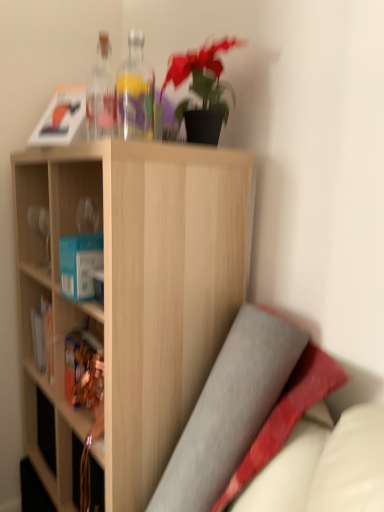
Question: From a real-world perspective, is transparent glass bottle at upper center, placed as the first bottle when sorted from right to left, located beneath matte brown book at left?

Choices:
 (A) no
 (B) yes

Answer: (A)

Question: Is transparent glass bottle at upper center, placed as the first bottle when sorted from right to left, taller than matte brown book at left?

Choices:
 (A) yes
 (B) no

Answer: (A)

Question: From the image's perspective, would you say transparent glass bottle at upper center, positioned as the second bottle in left-to-right order, is shown under matte brown book at left?

Choices:
 (A) yes
 (B) no

Answer: (B)

Question: Is transparent glass bottle at upper center, positioned as the second bottle in left-to-right order, located outside matte brown book at left?

Choices:
 (A) no
 (B) yes

Answer: (B)

Question: Is transparent glass bottle at upper center, positioned as the second bottle in left-to-right order, oriented towards matte brown book at left?

Choices:
 (A) no
 (B) yes

Answer: (A)

Question: Do you think transparent glass bottle at upper center, positioned as the second bottle in left-to-right order, is within matte brown book at left, or outside of it?

Choices:
 (A) outside
 (B) inside

Answer: (A)

Question: Is point click(127, 124) positioned closer to the camera than point click(76, 370)?

Choices:
 (A) closer
 (B) farther

Answer: (A)

Question: Is transparent glass bottle at upper center, placed as the first bottle when sorted from right to left, to the left or to the right of matte brown book at left in the image?

Choices:
 (A) left
 (B) right

Answer: (B)

Question: From the image's perspective, is transparent glass bottle at upper center, placed as the first bottle when sorted from right to left, positioned above or below matte brown book at left?

Choices:
 (A) above
 (B) below

Answer: (A)

Question: From the image's perspective, relative to transparent glass bottle at upper center, placed as the first bottle when sorted from right to left, is transparent glass bottles at upper center, which is counted as the first bottle, starting from the left, above or below?

Choices:
 (A) below
 (B) above

Answer: (B)

Question: Relative to transparent glass bottle at upper center, placed as the first bottle when sorted from right to left, is transparent glass bottles at upper center, the 2th bottle from the right, in front or behind?

Choices:
 (A) front
 (B) behind

Answer: (B)

Question: Based on their sizes in the image, would you say transparent glass bottles at upper center, which is counted as the first bottle, starting from the left, is bigger or smaller than transparent glass bottle at upper center, placed as the first bottle when sorted from right to left?

Choices:
 (A) small
 (B) big

Answer: (A)

Question: Is transparent glass bottles at upper center, the 2th bottle from the right, spatially inside transparent glass bottle at upper center, positioned as the second bottle in left-to-right order, or outside of it?

Choices:
 (A) outside
 (B) inside

Answer: (A)

Question: Considering the positions of point (109, 65) and point (96, 371), is point (109, 65) closer or farther from the camera than point (96, 371)?

Choices:
 (A) farther
 (B) closer

Answer: (A)

Question: Looking at their shapes, would you say transparent glass bottles at upper center, the 2th bottle from the right, is wider or thinner than matte brown book at left?

Choices:
 (A) wide
 (B) thin

Answer: (B)